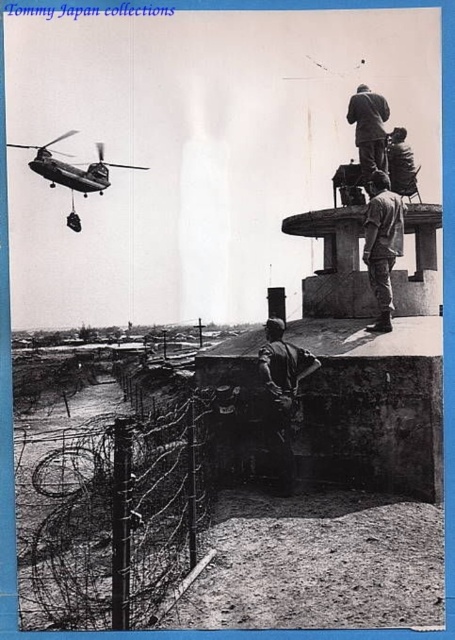
In the scene shown: You are a military analyst reviewing this historical photograph. You need to determine the exact location of the smooth gray uniform at upper center in the image. What are its coordinates?

The smooth gray uniform at upper center is located at coordinates point [369,129].